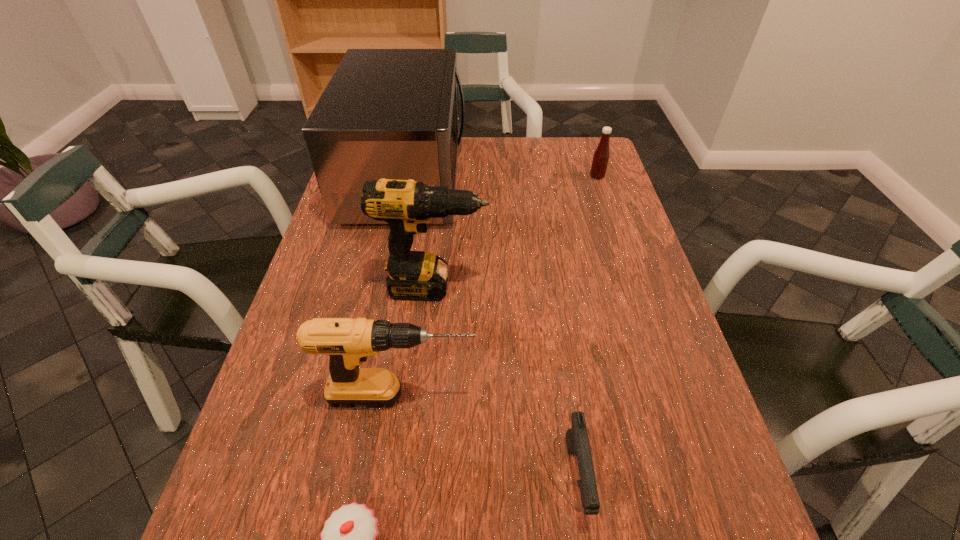
This screenshot has height=540, width=960. What are the coordinates of `free space at the far edge` in the screenshot? It's located at (484, 149).

Where is `free region at the left edge of the desktop`? free region at the left edge of the desktop is located at coordinates (277, 361).

In order to click on vacant space at the right edge of the desktop in this screenshot , I will do `click(692, 400)`.

At what (x,y) coordinates should I click in order to perform the action: click on vacant space at the far right corner of the desktop. Please return your answer as a coordinate pair (x, y). Looking at the image, I should click on (584, 163).

Find the location of a particular element. free space that is in between the microwave oven and the pistol is located at coordinates (491, 328).

Locate an element on the screen. The image size is (960, 540). vacant area that lies between the Tabasco sauce and the fifth tallest object is located at coordinates tap(587, 327).

This screenshot has width=960, height=540. Find the location of `empty space that is in between the pistol and the third shortest object`. empty space that is in between the pistol and the third shortest object is located at coordinates (587, 327).

In order to click on free area in between the second object from right to left and the shorter drill in this screenshot , I will do `click(489, 437)`.

At what (x,y) coordinates should I click in order to perform the action: click on the third closest object relative to the nearer drill. Please return your answer as a coordinate pair (x, y). Looking at the image, I should click on (406, 205).

Locate which object ranks in proximity to the nearer drill. Please provide its 2D coordinates. Your answer should be formatted as a tuple, i.e. [(x, y)], where the tuple contains the x and y coordinates of a point satisfying the conditions above.

[(577, 440)]